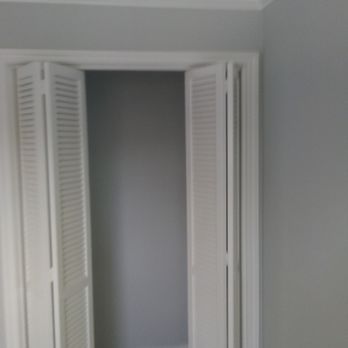
Locate an element on the screen. closet doors is located at coordinates (211, 223).